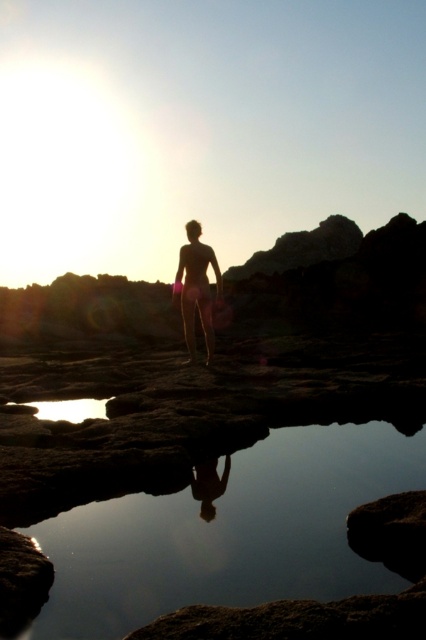
You are a photographer standing at the rocky shoreline during sunset. You notice a transparent water at center and a transparent glass puddle at lower center. Which object is closer to the camera? Please explain your reasoning based on their positions.

Result: The transparent glass puddle at lower center is closer to the camera because it is positioned above the transparent water at center, meaning the puddle is in front of the water in the scene.

You are a photographer standing on the rocky shoreline at sunset. You want to capture a photo of the silhouette skin at center and the transparent water at center in the same frame. If your camera has a maximum focus range of 5 meters, will you be able to capture both objects clearly in focus?

The transparent water at center and silhouette skin at center are 5.78 meters apart. Since the distance between them exceeds the camera maximum focus range of 5 meters, you might not be able to capture both objects clearly in focus.

Looking at this image, you are standing on the rocks and want to reach the transparent water at center. The distance between you and the water is 2.70 meters. If your maximum comfortable walking distance on rocks is 2 meters, can you safely walk to the water without needing to jump?

The distance between you and the transparent water at center is 2.70 meters, which exceeds your maximum comfortable walking distance of 2 meters on rocks. Therefore, you would need to jump or find another path to reach the water safely.